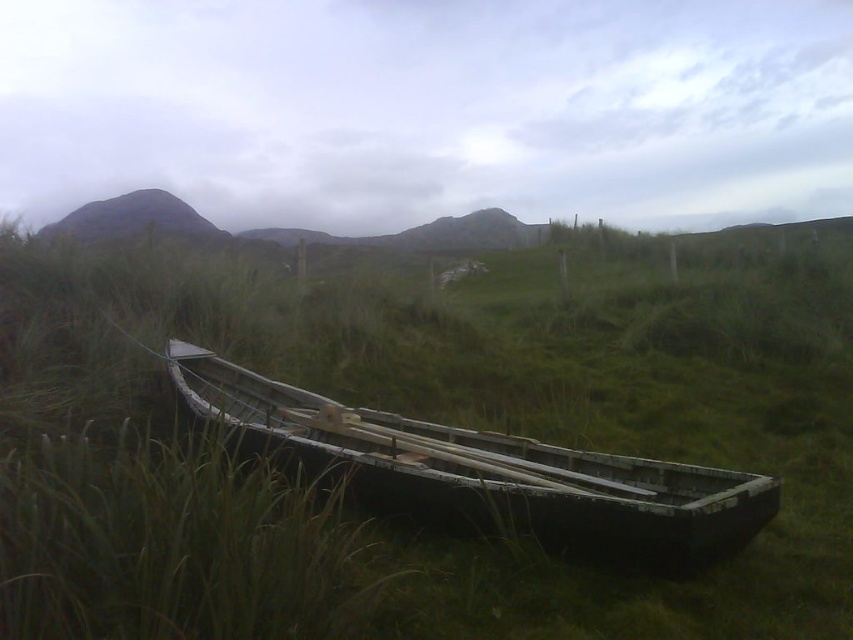
You are a hiker who wants to cross the field where the green matte grass at center and the dark gray wooden boat at center are located. Considering the height of the grass and the boat, which object will be easier to see from a distance?

The dark gray wooden boat at center will be easier to see from a distance because the green matte grass at center is taller than it, potentially obscuring the boat partially.

You are standing in the field and want to take a photo of the dark gray wooden boat at center without the green matte grass at center blocking the view. Is the boat visible from your current position?

The green matte grass at center is in front of the dark gray wooden boat at center, so the boat would be partially obscured by the grass and not fully visible from your current position.

You are a photographer standing in the middle of the grassy field where the boat is located. You want to take a photo that includes both the point at coordinates point(140, 321) and point(633, 492). Which point will appear closer to the camera in the final photo?

Point(140, 321) is further to the viewer than point(633, 492), so in the photo, point(140, 321) will appear closer to the camera than point(633, 492).